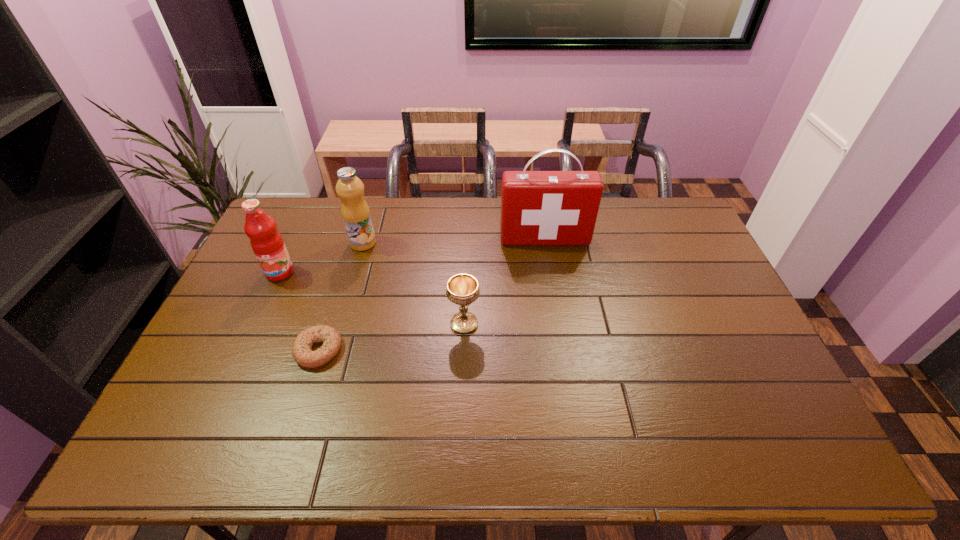
Where is `vacant space that is in between the rightmost object and the bagel`? vacant space that is in between the rightmost object and the bagel is located at coordinates (432, 294).

You are a GUI agent. You are given a task and a screenshot of the screen. Output one action in this format:
    pyautogui.click(x=<x>, y=<y>)
    Task: Click on the unoccupied area between the chalice and the right fruit juice
    This screenshot has height=540, width=960.
    Given the screenshot: What is the action you would take?
    pyautogui.click(x=414, y=284)

Locate which object is the fourth closest to the right fruit juice. Please provide its 2D coordinates. Your answer should be formatted as a tuple, i.e. [(x, y)], where the tuple contains the x and y coordinates of a point satisfying the conditions above.

[(537, 207)]

This screenshot has width=960, height=540. In order to click on object that is the third closest to the shortest object in this screenshot , I will do `click(355, 211)`.

Locate an element on the screen. The height and width of the screenshot is (540, 960). vacant point that satisfies the following two spatial constraints: 1. on the front label of the right fruit juice; 2. on the front side of the bagel is located at coordinates (332, 350).

Locate an element on the screen. The height and width of the screenshot is (540, 960). blank space that satisfies the following two spatial constraints: 1. on the front label of the farther fruit juice; 2. on the front label of the third nearest object is located at coordinates (354, 272).

This screenshot has width=960, height=540. Identify the location of free spot that satisfies the following two spatial constraints: 1. on the front face of the rightmost object; 2. on the front label of the right fruit juice. (545, 243).

This screenshot has height=540, width=960. I want to click on vacant space that satisfies the following two spatial constraints: 1. on the front label of the leftmost object; 2. on the right side of the second shortest object, so click(x=256, y=324).